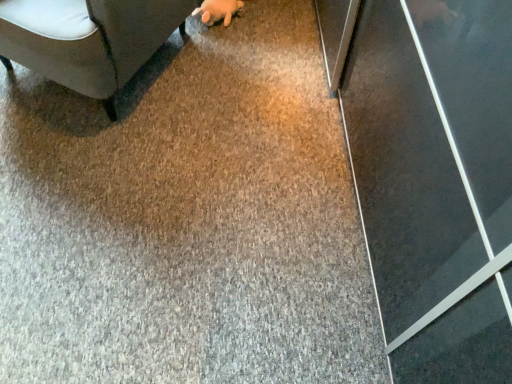
This screenshot has width=512, height=384. Describe the element at coordinates (88, 38) in the screenshot. I see `dark gray fabric couch at upper left` at that location.

In order to click on dark gray fabric couch at upper left in this screenshot , I will do `click(88, 38)`.

What is the approximate width of fuzzy beige hand at upper center?

9.26 inches.

This screenshot has height=384, width=512. Describe the element at coordinates (218, 11) in the screenshot. I see `fuzzy beige hand at upper center` at that location.

Identify the location of fuzzy beige hand at upper center. This screenshot has height=384, width=512. tap(218, 11).

Locate an element on the screen. Image resolution: width=512 pixels, height=384 pixels. dark gray fabric couch at upper left is located at coordinates (88, 38).

Considering the relative positions of fuzzy beige hand at upper center and dark gray fabric couch at upper left in the image provided, is fuzzy beige hand at upper center to the left of dark gray fabric couch at upper left from the viewer's perspective?

Incorrect, fuzzy beige hand at upper center is not on the left side of dark gray fabric couch at upper left.

Is fuzzy beige hand at upper center in front of or behind dark gray fabric couch at upper left in the image?

In the image, fuzzy beige hand at upper center appears behind dark gray fabric couch at upper left.

Between point (214, 21) and point (150, 38), which one is positioned behind?

The point (214, 21) is farther.

From the image's perspective, is fuzzy beige hand at upper center positioned above or below dark gray fabric couch at upper left?

fuzzy beige hand at upper center is above dark gray fabric couch at upper left.

From a real-world perspective, is fuzzy beige hand at upper center on top of dark gray fabric couch at upper left?

Actually, fuzzy beige hand at upper center is physically below dark gray fabric couch at upper left in the real world.

Between fuzzy beige hand at upper center and dark gray fabric couch at upper left, which one has larger width?

With larger width is dark gray fabric couch at upper left.

Between fuzzy beige hand at upper center and dark gray fabric couch at upper left, which one has more height?

dark gray fabric couch at upper left is taller.

Looking at the image, does fuzzy beige hand at upper center seem bigger or smaller compared to dark gray fabric couch at upper left?

In the image, fuzzy beige hand at upper center appears to be smaller than dark gray fabric couch at upper left.

Is fuzzy beige hand at upper center not within dark gray fabric couch at upper left?

Actually, fuzzy beige hand at upper center is at least partially inside dark gray fabric couch at upper left.

Is fuzzy beige hand at upper center touching dark gray fabric couch at upper left?

No.

Is fuzzy beige hand at upper center turned away from dark gray fabric couch at upper left?

That's right, fuzzy beige hand at upper center is facing away from dark gray fabric couch at upper left.

Where is `hand on the right of dark gray fabric couch at upper left`? The width and height of the screenshot is (512, 384). hand on the right of dark gray fabric couch at upper left is located at coordinates (218, 11).

Considering the relative positions of dark gray fabric couch at upper left and fuzzy beige hand at upper center in the image provided, is dark gray fabric couch at upper left to the right of fuzzy beige hand at upper center from the viewer's perspective?

No, dark gray fabric couch at upper left is not to the right of fuzzy beige hand at upper center.

Is dark gray fabric couch at upper left positioned before fuzzy beige hand at upper center?

Yes, it is.

Is point (138, 15) positioned behind point (220, 18)?

No.

From the image's perspective, which one is positioned higher, dark gray fabric couch at upper left or fuzzy beige hand at upper center?

From the image's view, fuzzy beige hand at upper center is above.

From a real-world perspective, is dark gray fabric couch at upper left above or below fuzzy beige hand at upper center?

Clearly, from a real-world perspective, dark gray fabric couch at upper left is above fuzzy beige hand at upper center.

Which object is thinner, dark gray fabric couch at upper left or fuzzy beige hand at upper center?

Thinner between the two is fuzzy beige hand at upper center.

Who is shorter, dark gray fabric couch at upper left or fuzzy beige hand at upper center?

Standing shorter between the two is fuzzy beige hand at upper center.

Considering the sizes of objects dark gray fabric couch at upper left and fuzzy beige hand at upper center in the image provided, who is smaller, dark gray fabric couch at upper left or fuzzy beige hand at upper center?

fuzzy beige hand at upper center is smaller.

Is dark gray fabric couch at upper left positioned beyond the bounds of fuzzy beige hand at upper center?

dark gray fabric couch at upper left lies outside fuzzy beige hand at upper center's area.

Is dark gray fabric couch at upper left touching fuzzy beige hand at upper center?

There is a gap between dark gray fabric couch at upper left and fuzzy beige hand at upper center.

Is dark gray fabric couch at upper left facing towards fuzzy beige hand at upper center?

No, dark gray fabric couch at upper left is not aimed at fuzzy beige hand at upper center.

How different are the orientations of dark gray fabric couch at upper left and fuzzy beige hand at upper center in degrees?

0.14 degrees separate the facing orientations of dark gray fabric couch at upper left and fuzzy beige hand at upper center.

Find the location of a particular element. hand located behind the dark gray fabric couch at upper left is located at coordinates (218, 11).

I want to click on furniture lying below the fuzzy beige hand at upper center (from the image's perspective), so click(x=88, y=38).

The width and height of the screenshot is (512, 384). I want to click on furniture lying in front of the fuzzy beige hand at upper center, so click(x=88, y=38).